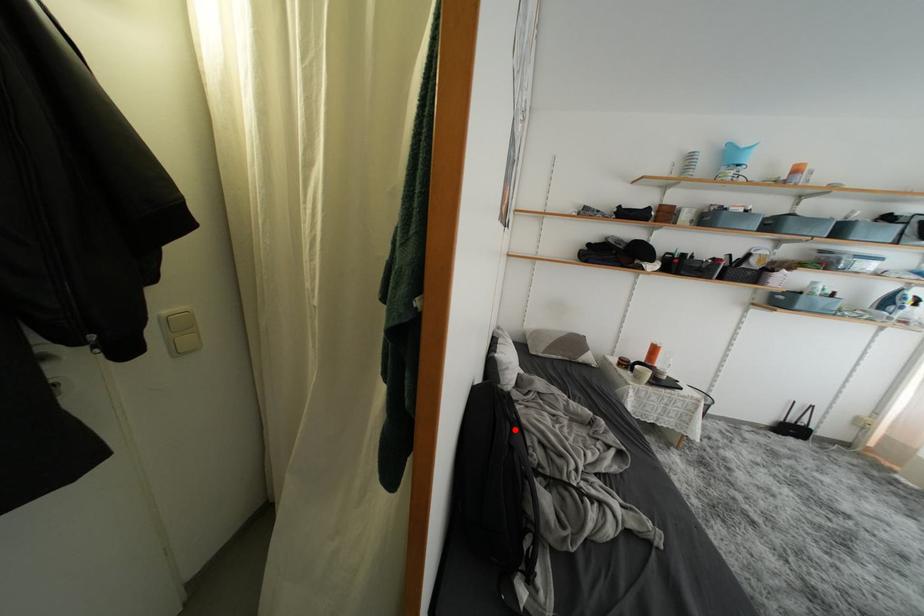
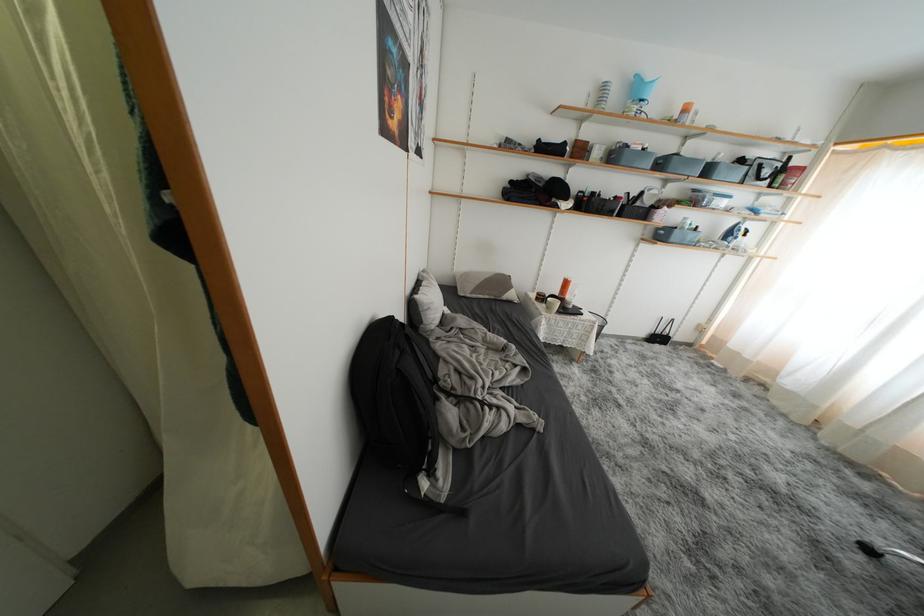
Locate, in the second image, the point that corresponds to the highlighted location in the first image.

(404, 357)